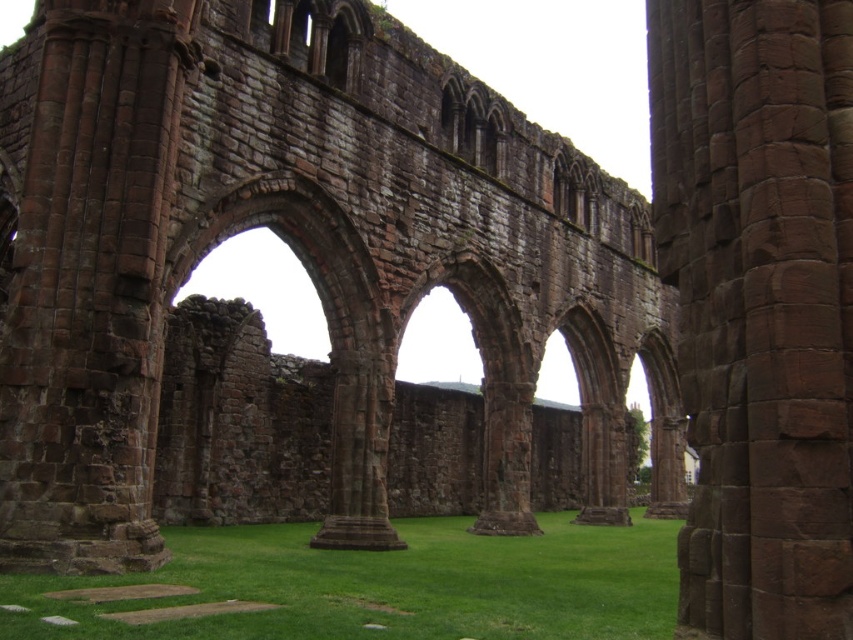
Question: Can you confirm if green grass at center is smaller than brown stone arch at center?

Choices:
 (A) yes
 (B) no

Answer: (B)

Question: Does green grass at center come in front of brown stone arch at center?

Choices:
 (A) yes
 (B) no

Answer: (A)

Question: Which object is positioned closest to the brown stone arch at center?

Choices:
 (A) green grass at center
 (B) brown stone pillar at center

Answer: (A)

Question: Can you confirm if green grass at center is smaller than brown stone arch at center?

Choices:
 (A) no
 (B) yes

Answer: (A)

Question: Which of these objects is positioned closest to the brown stone pillar at center?

Choices:
 (A) brown stone arch at center
 (B) green grass at center

Answer: (B)

Question: Among these objects, which one is nearest to the camera?

Choices:
 (A) brown stone pillar at center
 (B) brown stone arch at center
 (C) green grass at center

Answer: (A)